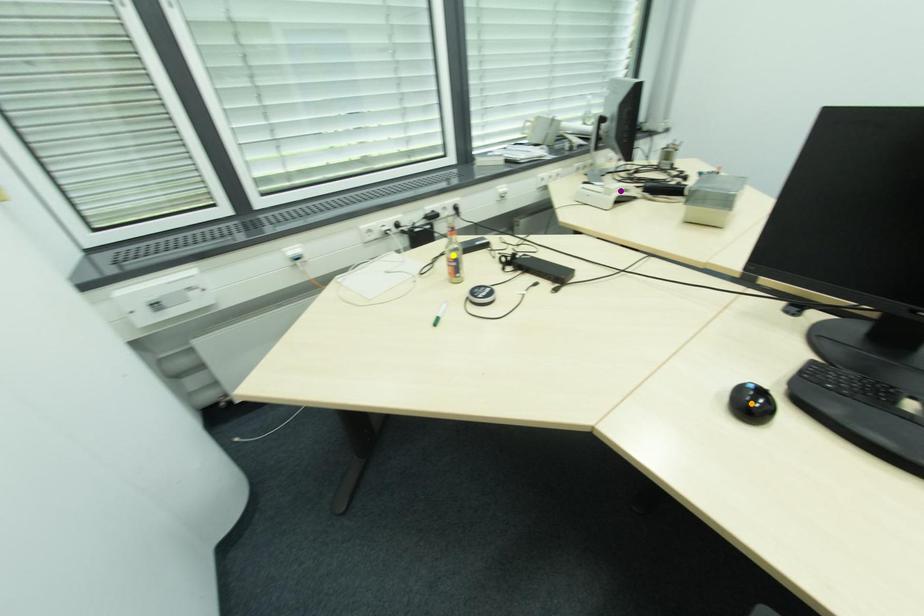
Looking at this image, order these from farthest to nearest:
A) purple point
B) yellow point
C) orange point

purple point
yellow point
orange point